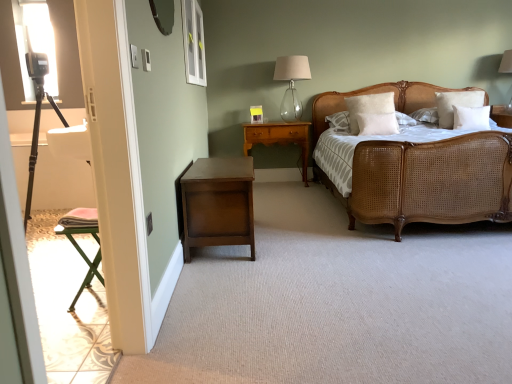
Question: Is transparent glass window at upper center facing away from matte silver mirror at upper center?

Choices:
 (A) yes
 (B) no

Answer: (B)

Question: Considering the relative sizes of transparent glass window at upper center and matte silver mirror at upper center in the image provided, is transparent glass window at upper center bigger than matte silver mirror at upper center?

Choices:
 (A) yes
 (B) no

Answer: (A)

Question: Considering the relative sizes of transparent glass window at upper center and matte silver mirror at upper center in the image provided, is transparent glass window at upper center thinner than matte silver mirror at upper center?

Choices:
 (A) yes
 (B) no

Answer: (A)

Question: Is transparent glass window at upper center not close to matte silver mirror at upper center?

Choices:
 (A) yes
 (B) no

Answer: (A)

Question: Considering the relative sizes of transparent glass window at upper center and matte silver mirror at upper center in the image provided, is transparent glass window at upper center shorter than matte silver mirror at upper center?

Choices:
 (A) no
 (B) yes

Answer: (A)

Question: Considering the positions of point (476, 92) and point (247, 152), is point (476, 92) closer or farther from the camera than point (247, 152)?

Choices:
 (A) closer
 (B) farther

Answer: (A)

Question: Is white soft pillow at upper right, the first pillow in the right-to-left sequence, situated inside wooden nightstand at center, marked as the second nightstand in a front-to-back arrangement, or outside?

Choices:
 (A) outside
 (B) inside

Answer: (A)

Question: From a real-world perspective, is white soft pillow at upper right, which is the fourth pillow from left to right, positioned above or below wooden nightstand at center, marked as the second nightstand in a front-to-back arrangement?

Choices:
 (A) below
 (B) above

Answer: (B)

Question: Is white soft pillow at upper right, which is the fourth pillow from left to right, bigger or smaller than wooden nightstand at center, marked as the second nightstand in a front-to-back arrangement?

Choices:
 (A) small
 (B) big

Answer: (A)

Question: From a real-world perspective, is white soft pillow at center, the second pillow in the left-to-right sequence, above or below white soft pillow at upper right, marked as the third pillow in a left-to-right arrangement?

Choices:
 (A) below
 (B) above

Answer: (A)

Question: From the image's perspective, is white soft pillow at center, the second pillow in the left-to-right sequence, above or below white soft pillow at upper right, which is the 2th pillow from right to left?

Choices:
 (A) above
 (B) below

Answer: (B)

Question: From their relative heights in the image, would you say white soft pillow at center, which is the 3th pillow from right to left, is taller or shorter than white soft pillow at upper right, marked as the third pillow in a left-to-right arrangement?

Choices:
 (A) short
 (B) tall

Answer: (A)

Question: Is white soft pillow at center, the second pillow in the left-to-right sequence, wider or thinner than white soft pillow at upper right, which is the 2th pillow from right to left?

Choices:
 (A) wide
 (B) thin

Answer: (B)

Question: Which is correct: woven cane bed at center is inside white soft pillow at upper right, the first pillow in the right-to-left sequence, or outside of it?

Choices:
 (A) outside
 (B) inside

Answer: (A)

Question: In terms of height, does woven cane bed at center look taller or shorter compared to white soft pillow at upper right, the first pillow in the right-to-left sequence?

Choices:
 (A) tall
 (B) short

Answer: (A)